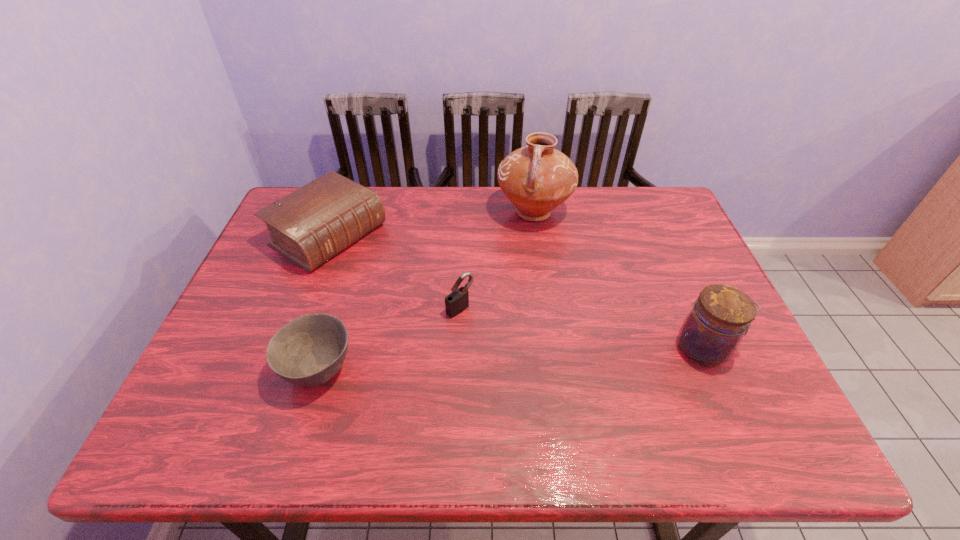
The height and width of the screenshot is (540, 960). I want to click on object that can be found as the second closest to the pottery, so click(x=311, y=225).

Find the location of a particular element. This screenshot has height=540, width=960. blank area in the image that satisfies the following two spatial constraints: 1. on the back side of the bowl; 2. on the lid of the rightmost object is located at coordinates (325, 348).

Identify the location of free region that satisfies the following two spatial constraints: 1. on the back side of the third nearest object; 2. on the left side of the bowl. This screenshot has height=540, width=960. (337, 308).

Identify the location of vacant position in the image that satisfies the following two spatial constraints: 1. on the front side of the bowl; 2. on the right side of the Bible. (277, 369).